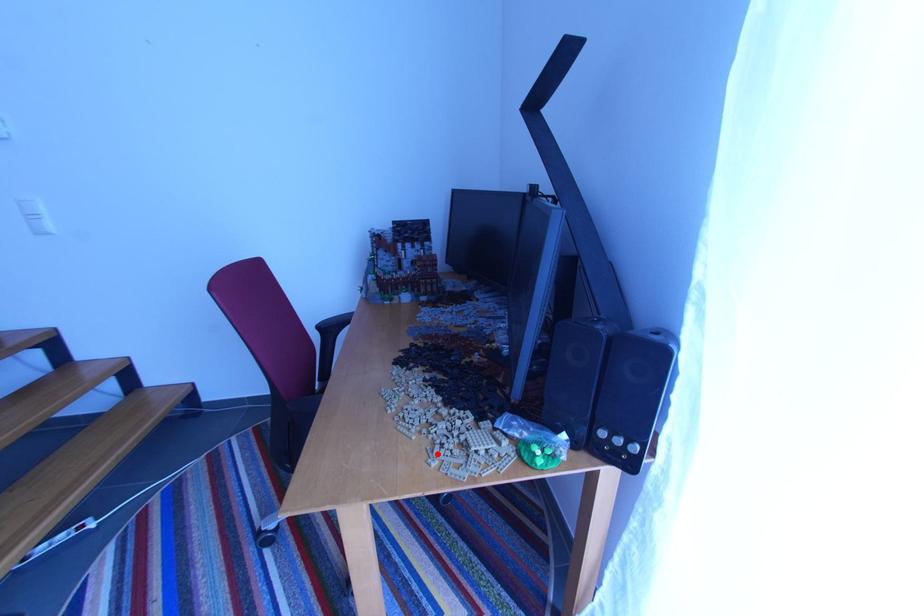
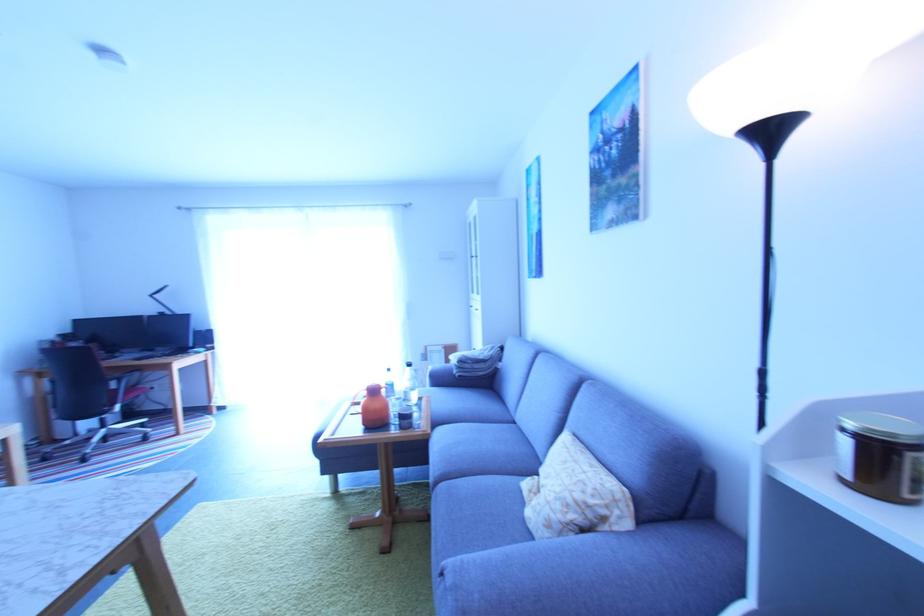
Question: I am providing you with two images of the same scene from different viewpoints. A red point is marked on the first image. Can you still see the location of the red point in image 2?

Choices:
 (A) Yes
 (B) No

Answer: (B)